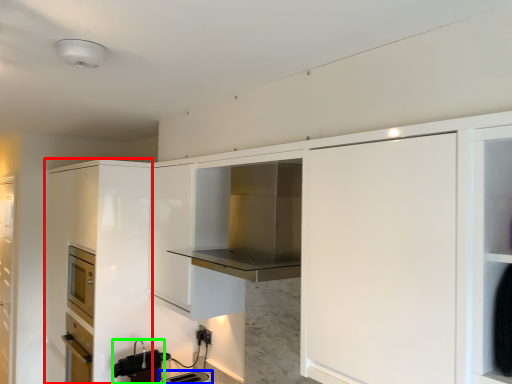
Question: Which is farther away from cabinetry (highlighted by a red box)? appliance (highlighted by a blue box) or appliance (highlighted by a green box)?

Choices:
 (A) appliance
 (B) appliance

Answer: (A)